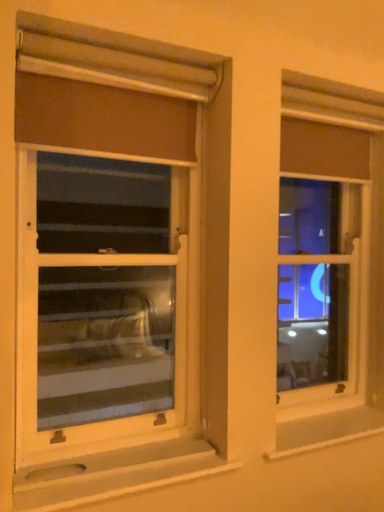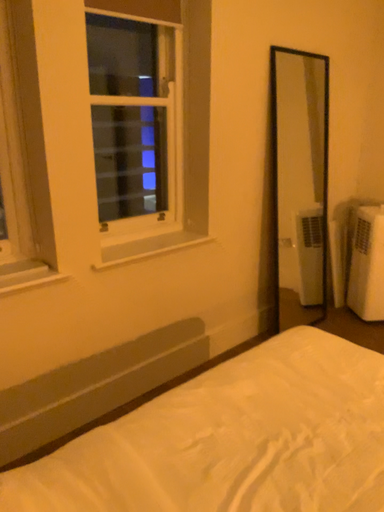
Question: Which way did the camera rotate in the video?

Choices:
 (A) rotated upward
 (B) rotated downward

Answer: (B)